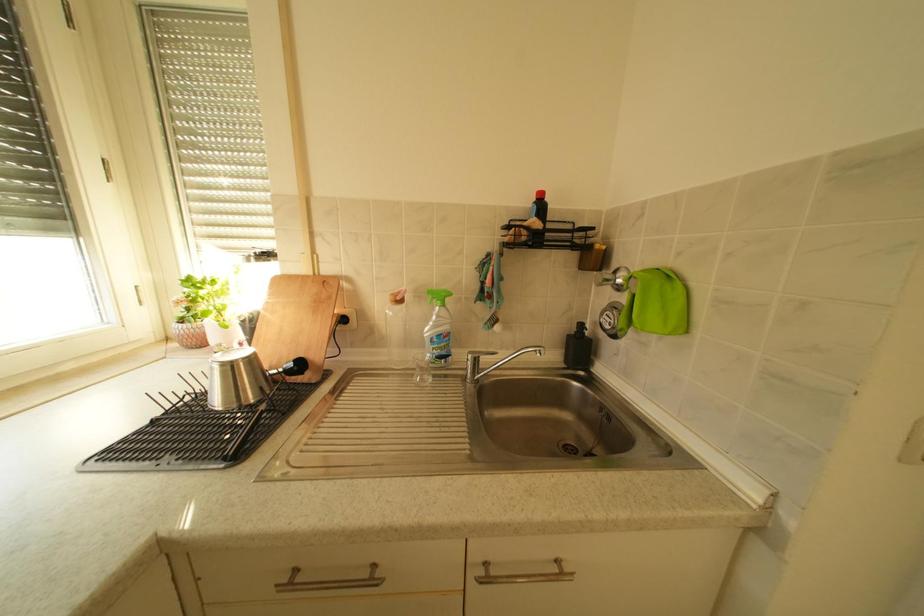
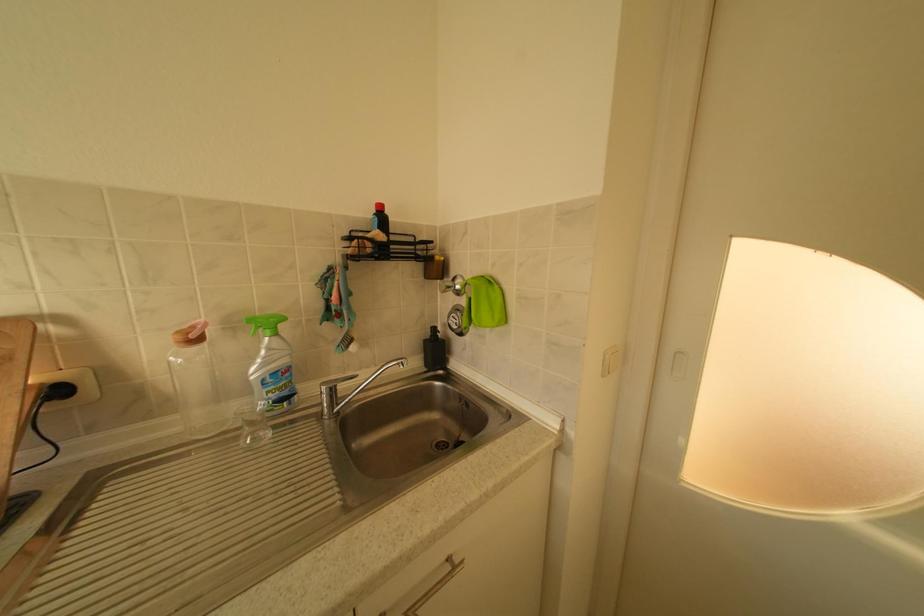
Question: The images are taken continuously from a first-person perspective. In which direction is your viewpoint rotating?

Choices:
 (A) Left
 (B) Right
 (C) Up
 (D) Down

Answer: (B)